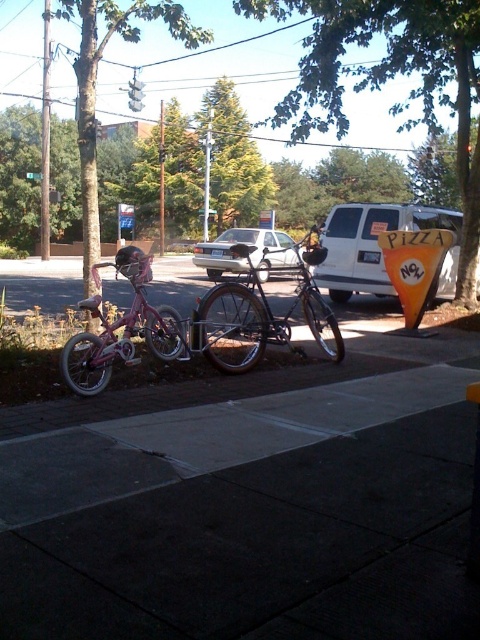
You are a delivery person trying to park your bike on the dark gray concrete sidewalk at lower center. The pink matte bicycle at left is already parked there. Can you fit your bike next to it without overlapping?

The dark gray concrete sidewalk at lower center is shorter than the pink matte bicycle at left, so there might not be enough space to park another bike next to it without overlapping.

You are a delivery person carrying a pizza box that is 1.8 meters wide. You need to walk from the orange pizza sign to the dark gray concrete sidewalk at lower center. Is there enough space between them to pass through comfortably?

The distance between the orange pizza sign and the dark gray concrete sidewalk at lower center is 2.05 meters. Since your pizza box is 1.8 meters wide, there is enough space to pass through comfortably.